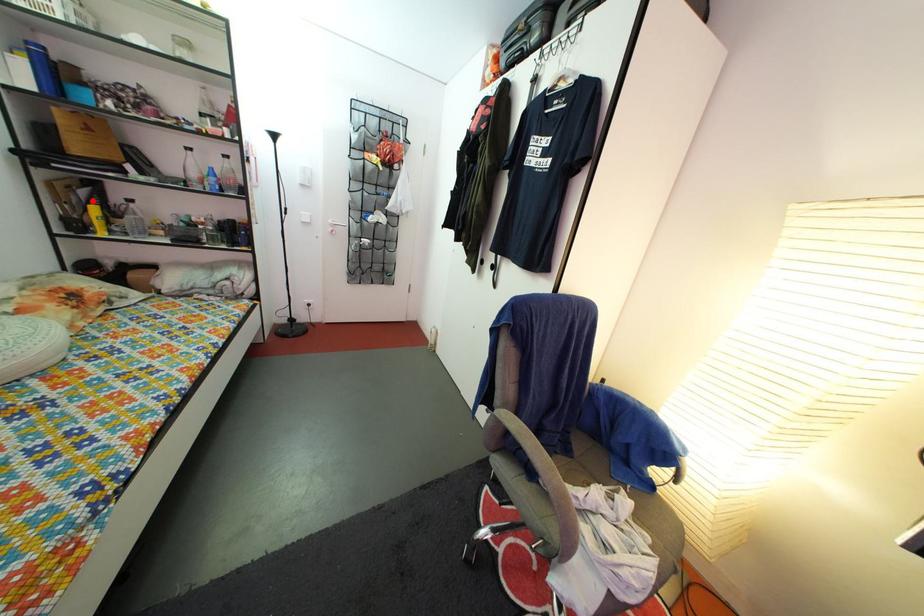
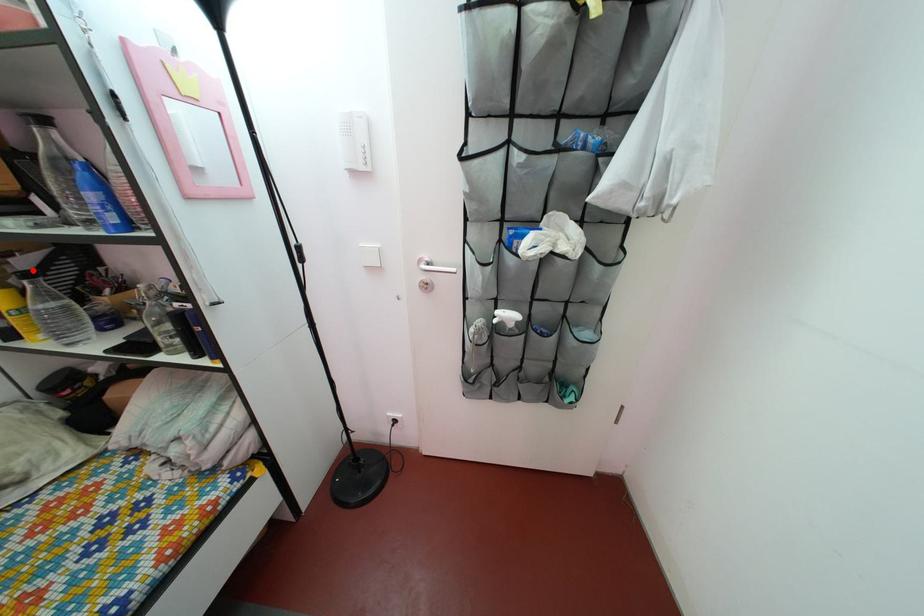
I am providing you with two images of the same scene from different viewpoints. A red point is marked on the first image and another point is marked on the second image. Does the point marked in image1 correspond to the same location as the one in image2?

Yes